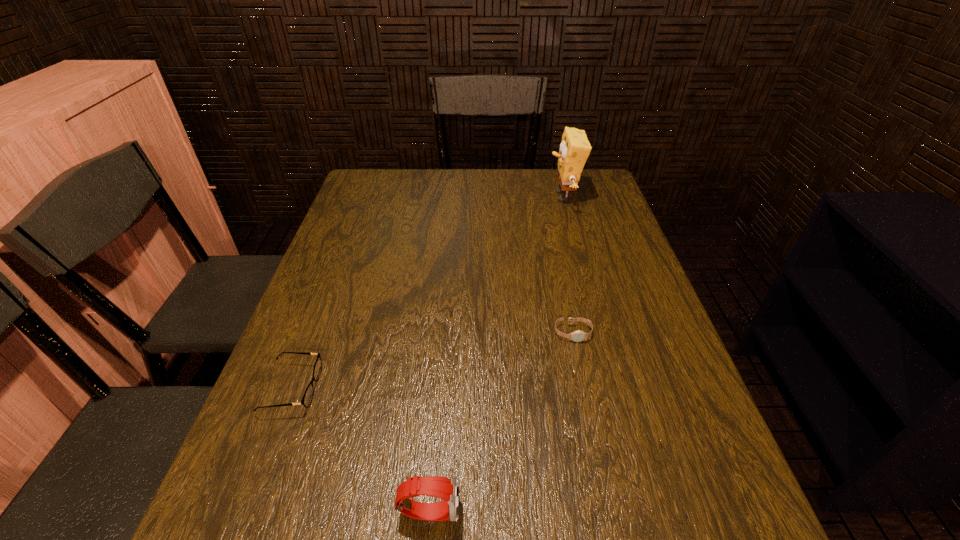
At what (x,y) coordinates should I click in order to perform the action: click on sponge. Please return your answer as a coordinate pair (x, y). Looking at the image, I should click on (574, 150).

Identify the location of the farthest object. Image resolution: width=960 pixels, height=540 pixels. (574, 150).

Locate an element on the screen. Image resolution: width=960 pixels, height=540 pixels. the second tallest object is located at coordinates (448, 489).

This screenshot has width=960, height=540. In order to click on the left watch in this screenshot , I will do `click(448, 489)`.

Where is `spectacles`? spectacles is located at coordinates (307, 398).

The height and width of the screenshot is (540, 960). I want to click on the leftmost object, so click(x=307, y=398).

Where is `the shorter watch`? the shorter watch is located at coordinates (577, 336).

Locate an element on the screen. The height and width of the screenshot is (540, 960). the right watch is located at coordinates (577, 336).

Locate an element on the screen. Image resolution: width=960 pixels, height=540 pixels. free spot located 0.350m on the face of the tallest object is located at coordinates (441, 197).

I want to click on vacant space positioned on the face of the tallest object, so click(x=435, y=197).